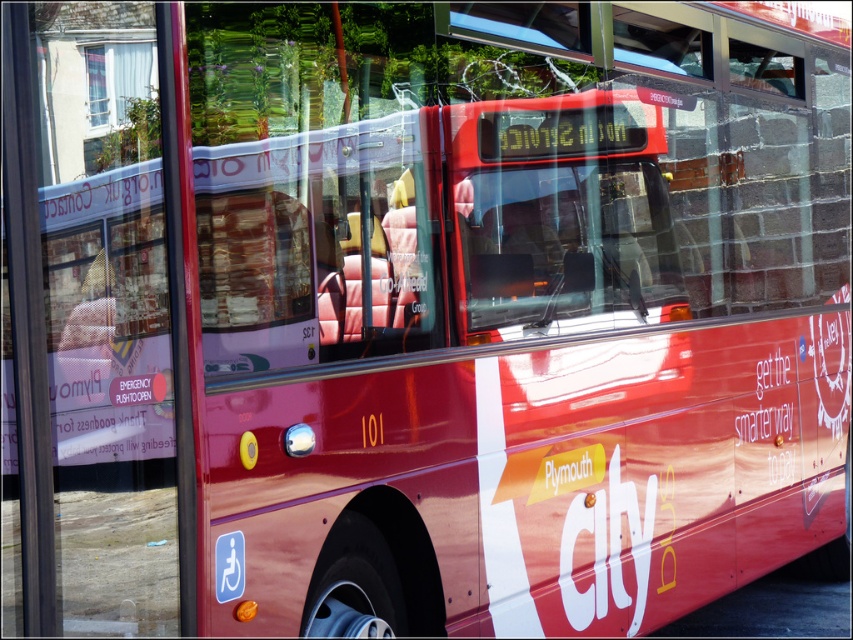
Is transparent glass window at upper center to the right of white curtain at upper left from the viewer's perspective?

Correct, you'll find transparent glass window at upper center to the right of white curtain at upper left.

This screenshot has height=640, width=853. What are the coordinates of `transparent glass window at upper center` in the screenshot? It's located at (659, 44).

Can you confirm if glossy red bus at center is bigger than transparent glass window at upper center?

Indeed, glossy red bus at center has a larger size compared to transparent glass window at upper center.

Does glossy red bus at center appear over transparent glass window at upper center?

Actually, glossy red bus at center is below transparent glass window at upper center.

Between point (28, 324) and point (708, 54), which one is positioned behind?

The point (708, 54) is behind.

The height and width of the screenshot is (640, 853). I want to click on glossy red bus at center, so click(x=103, y=314).

Can you confirm if glossy red bus at center is taller than white curtain at upper left?

Indeed, glossy red bus at center has a greater height compared to white curtain at upper left.

Between glossy red bus at center and white curtain at upper left, which one appears on the right side from the viewer's perspective?

From the viewer's perspective, glossy red bus at center appears more on the right side.

What are the coordinates of `glossy red bus at center` in the screenshot? It's located at (103, 314).